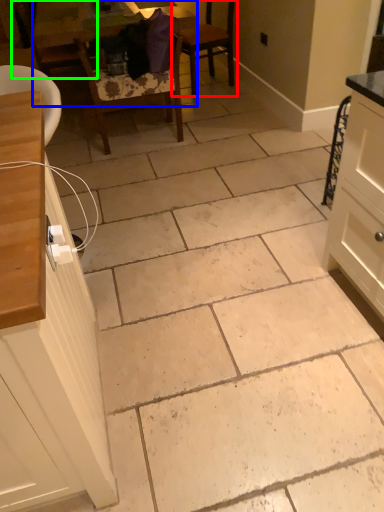
Question: Which is farther away from chair (highlighted by a red box)? table (highlighted by a blue box) or chair (highlighted by a green box)?

Choices:
 (A) table
 (B) chair

Answer: (B)